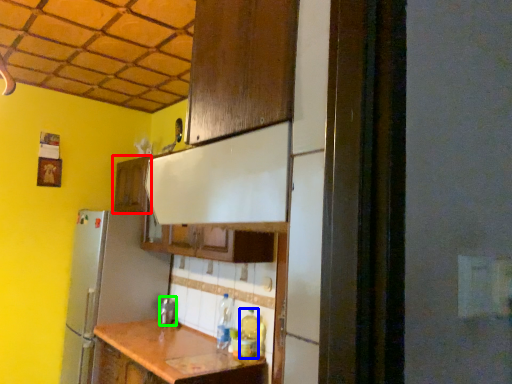
Question: Which object is the closest to the cabinetry (highlighted by a red box)? Choose among these: bottle (highlighted by a blue box) or silver (highlighted by a green box).

Choices:
 (A) bottle
 (B) silver

Answer: (B)